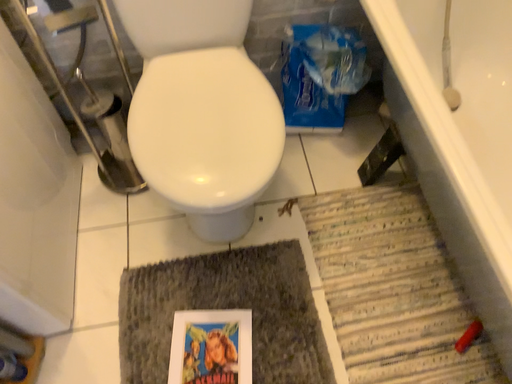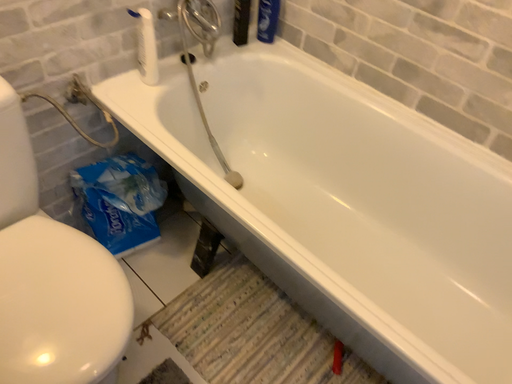
Question: How did the camera likely rotate when shooting the video?

Choices:
 (A) rotated downward
 (B) rotated upward

Answer: (B)